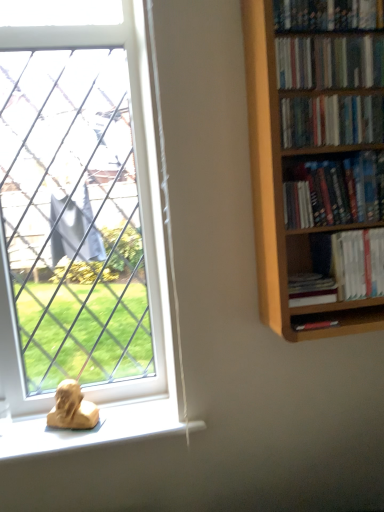
Question: Can you confirm if hardcover books at upper right, which appears as the fourth book when ordered from the bottom, is bigger than white plastic window at lower left?

Choices:
 (A) yes
 (B) no

Answer: (B)

Question: Can you confirm if hardcover books at upper right, acting as the 3th book starting from the top, is taller than white plastic window at lower left?

Choices:
 (A) yes
 (B) no

Answer: (B)

Question: Considering the relative positions of hardcover books at upper right, which appears as the fourth book when ordered from the bottom, and white plastic window at lower left in the image provided, is hardcover books at upper right, which appears as the fourth book when ordered from the bottom, to the left of white plastic window at lower left from the viewer's perspective?

Choices:
 (A) yes
 (B) no

Answer: (B)

Question: Is hardcover books at upper right, which appears as the fourth book when ordered from the bottom, oriented away from white plastic window at lower left?

Choices:
 (A) yes
 (B) no

Answer: (B)

Question: Is hardcover books at upper right, acting as the 3th book starting from the top, aimed at white plastic window at lower left?

Choices:
 (A) no
 (B) yes

Answer: (A)

Question: Is white paperbacks at center-right, the second book when ordered from bottom to top, taller or shorter than wooden bookcase at right?

Choices:
 (A) short
 (B) tall

Answer: (A)

Question: From a real-world perspective, relative to wooden bookcase at right, is white paperbacks at center-right, which is counted as the fifth book, starting from the top, vertically above or below?

Choices:
 (A) below
 (B) above

Answer: (A)

Question: Would you say white paperbacks at center-right, which is counted as the fifth book, starting from the top, is inside or outside wooden bookcase at right?

Choices:
 (A) inside
 (B) outside

Answer: (A)

Question: Is point coord(375,242) positioned closer to the camera than point coord(281,290)?

Choices:
 (A) farther
 (B) closer

Answer: (A)

Question: Does point coord(360,0) appear closer or farther from the camera than point coord(324,287)?

Choices:
 (A) farther
 (B) closer

Answer: (B)

Question: From their relative heights in the image, would you say hardcover books at upper right, the 1th book positioned from the top, is taller or shorter than hardcover book at right, arranged as the sixth book when viewed from the top?

Choices:
 (A) short
 (B) tall

Answer: (B)

Question: From a real-world perspective, is hardcover books at upper right, the 1th book positioned from the top, above or below hardcover book at right, which is counted as the 1th book, starting from the bottom?

Choices:
 (A) above
 (B) below

Answer: (A)

Question: Is hardcover books at upper right, which is counted as the 6th book, starting from the bottom, inside or outside of hardcover book at right, arranged as the sixth book when viewed from the top?

Choices:
 (A) inside
 (B) outside

Answer: (B)

Question: Visually, is hardcover books at upper right, the 1th book positioned from the top, positioned to the left or to the right of white paperbacks at center-right, the second book when ordered from bottom to top?

Choices:
 (A) right
 (B) left

Answer: (B)

Question: Based on their sizes in the image, would you say hardcover books at upper right, the 1th book positioned from the top, is bigger or smaller than white paperbacks at center-right, the second book when ordered from bottom to top?

Choices:
 (A) small
 (B) big

Answer: (B)